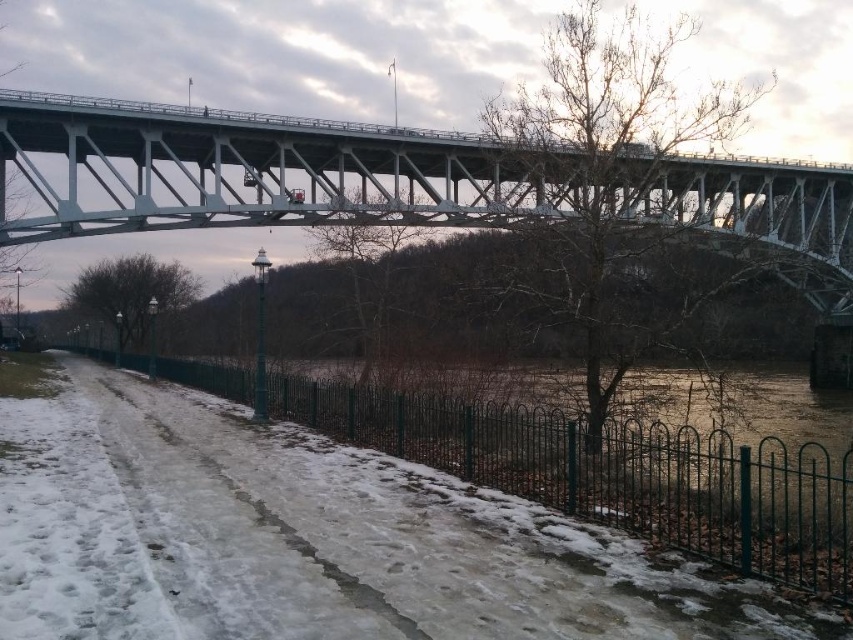
Who is positioned more to the left, white powdery snow at lower left or white metallic bridge at upper center?

white powdery snow at lower left is more to the left.

Who is more forward, (389,516) or (527,163)?

Point (389,516) is in front.

The width and height of the screenshot is (853, 640). I want to click on white powdery snow at lower left, so click(x=309, y=538).